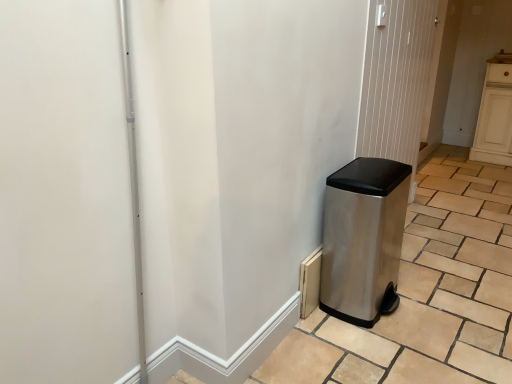
Question: Should I look upward or downward to see satin silver trash can at right?

Choices:
 (A) down
 (B) up

Answer: (A)

Question: From a real-world perspective, does satin silver trash can at right stand above stainless steel trash can at right?

Choices:
 (A) no
 (B) yes

Answer: (A)

Question: Is satin silver trash can at right closer to camera compared to stainless steel trash can at right?

Choices:
 (A) yes
 (B) no

Answer: (A)

Question: Is satin silver trash can at right at the right side of stainless steel trash can at right?

Choices:
 (A) yes
 (B) no

Answer: (A)

Question: Is satin silver trash can at right completely or partially outside of stainless steel trash can at right?

Choices:
 (A) yes
 (B) no

Answer: (A)

Question: Does satin silver trash can at right have a greater height compared to stainless steel trash can at right?

Choices:
 (A) no
 (B) yes

Answer: (A)

Question: Considering the relative sizes of satin silver trash can at right and stainless steel trash can at right in the image provided, is satin silver trash can at right wider than stainless steel trash can at right?

Choices:
 (A) no
 (B) yes

Answer: (B)

Question: Can you confirm if satin silver trash can at right is bigger than stainless steel trash can at right?

Choices:
 (A) no
 (B) yes

Answer: (B)

Question: Is satin silver trash can at right at the left side of stainless steel trash can at right?

Choices:
 (A) no
 (B) yes

Answer: (A)

Question: Is satin silver trash can at right thinner than stainless steel trash can at right?

Choices:
 (A) yes
 (B) no

Answer: (B)

Question: Is satin silver trash can at right positioned beyond the bounds of stainless steel trash can at right?

Choices:
 (A) no
 (B) yes

Answer: (B)

Question: Is satin silver trash can at right oriented away from stainless steel trash can at right?

Choices:
 (A) no
 (B) yes

Answer: (A)

Question: Are satin silver trash can at right and stainless steel trash can at right far apart?

Choices:
 (A) no
 (B) yes

Answer: (A)

Question: From a real-world perspective, is stainless steel trash can at right physically below stainless steel trash can at right?

Choices:
 (A) yes
 (B) no

Answer: (B)